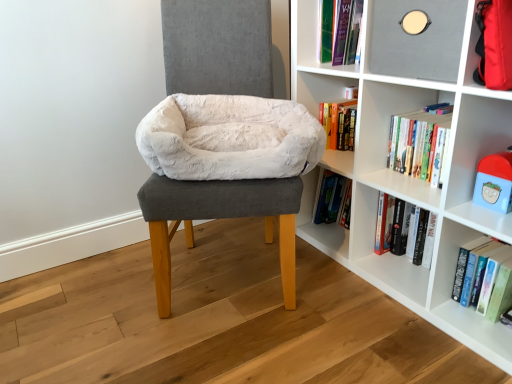
I want to click on vacant space to the right of white plush pet bed at center, so click(352, 298).